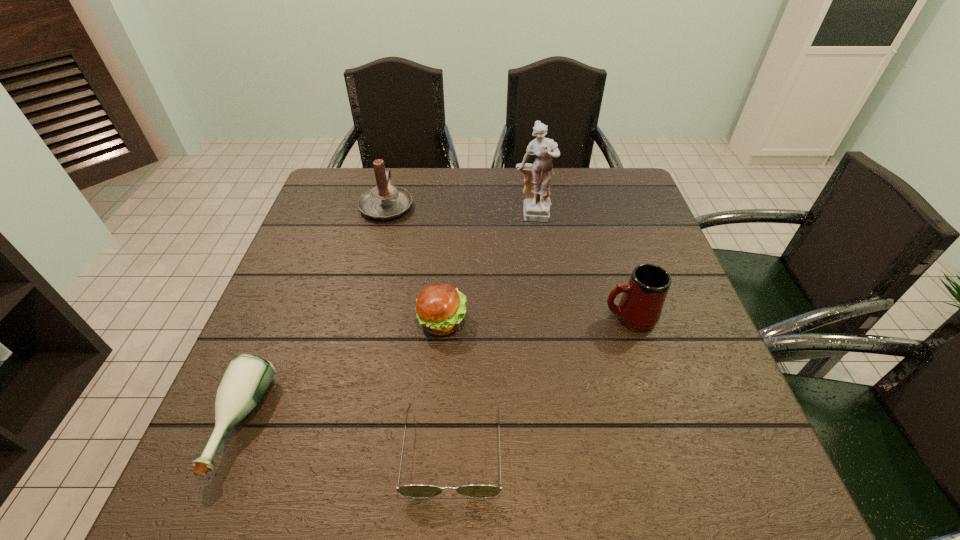
You are a GUI agent. You are given a task and a screenshot of the screen. Output one action in this format:
    pyautogui.click(x=<x>, y=<y>)
    Task: Click on the bottle at the near edge
    
    Given the screenshot: What is the action you would take?
    [247, 377]

The width and height of the screenshot is (960, 540). I want to click on sunglasses that is positioned at the near edge, so click(417, 491).

Where is `candle situated at the left edge`? candle situated at the left edge is located at coordinates pyautogui.click(x=384, y=201).

Find the location of a particular element. The height and width of the screenshot is (540, 960). bottle located at the left edge is located at coordinates (247, 377).

Where is `object present at the right edge`? This screenshot has height=540, width=960. object present at the right edge is located at coordinates (640, 307).

Where is `object that is at the far left corner`? Image resolution: width=960 pixels, height=540 pixels. object that is at the far left corner is located at coordinates (384, 201).

Locate an element on the screen. The image size is (960, 540). object present at the near left corner is located at coordinates (247, 377).

In the image, there is a desktop. At what (x,y) coordinates should I click in order to perform the action: click on vacant space at the far edge. Please return your answer as a coordinate pair (x, y). Looking at the image, I should click on (x=494, y=202).

The width and height of the screenshot is (960, 540). I want to click on vacant space at the near edge of the desktop, so click(x=326, y=465).

Locate an element on the screen. vacant area at the left edge is located at coordinates (288, 303).